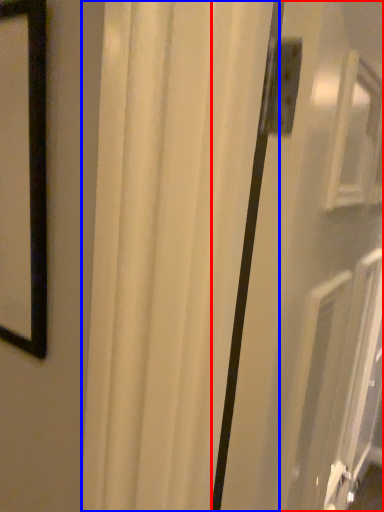
Question: Among these objects, which one is farthest to the camera, screen door (highlighted by a red box) or curtain (highlighted by a blue box)?

Choices:
 (A) screen door
 (B) curtain

Answer: (B)